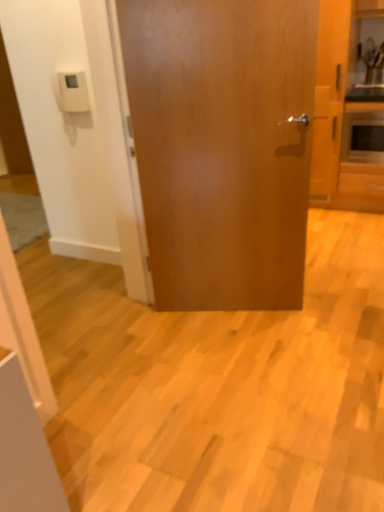
The height and width of the screenshot is (512, 384). What are the coordinates of `vacant space underneath glossy wood door at center (from a real-world perspective)` in the screenshot? It's located at (244, 310).